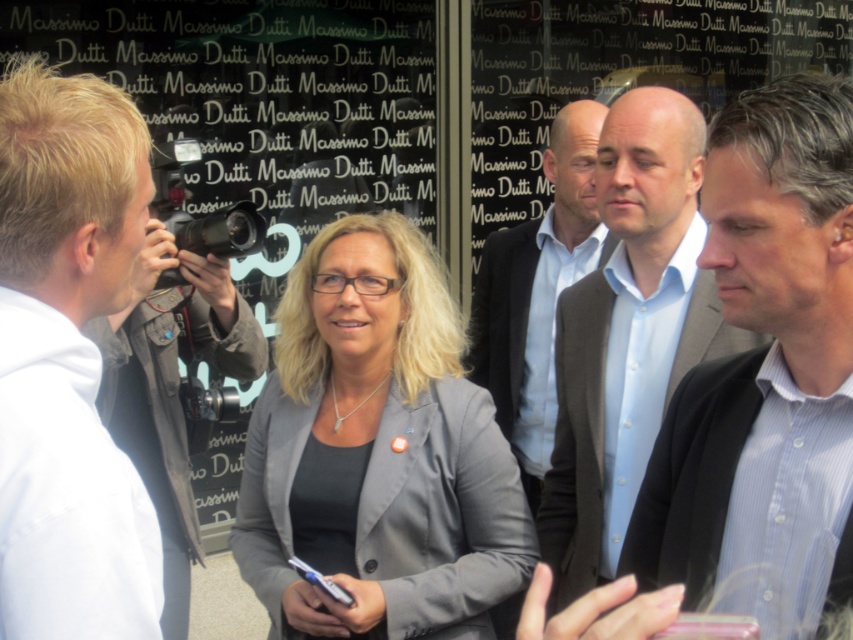
Is gray fabric jacket at center to the left of blue striped shirt at right from the viewer's perspective?

Indeed, gray fabric jacket at center is positioned on the left side of blue striped shirt at right.

Does point (335, 282) lie behind point (721, 390)?

That is True.

Who is more forward, (289, 544) or (680, 456)?

Positioned in front is point (680, 456).

Image resolution: width=853 pixels, height=640 pixels. Find the location of `gray fabric jacket at center`. gray fabric jacket at center is located at coordinates (376, 451).

Between point (270, 433) and point (540, 412), which one is positioned in front?

Point (270, 433) is more forward.

Which is more to the left, gray fabric jacket at center or light blue shirt at center?

gray fabric jacket at center is more to the left.

Is point (294, 292) positioned after point (521, 342)?

That is False.

Image resolution: width=853 pixels, height=640 pixels. Find the location of `gray fabric jacket at center`. gray fabric jacket at center is located at coordinates (376, 451).

Who is higher up, white cotton shirt at left or dark gray suit at center?

Positioned higher is white cotton shirt at left.

Which is behind, point (123, 116) or point (564, 330)?

The point (564, 330) is more distant.

What do you see at coordinates (68, 362) in the screenshot? This screenshot has width=853, height=640. I see `white cotton shirt at left` at bounding box center [68, 362].

Identify the location of white cotton shirt at left. point(68,362).